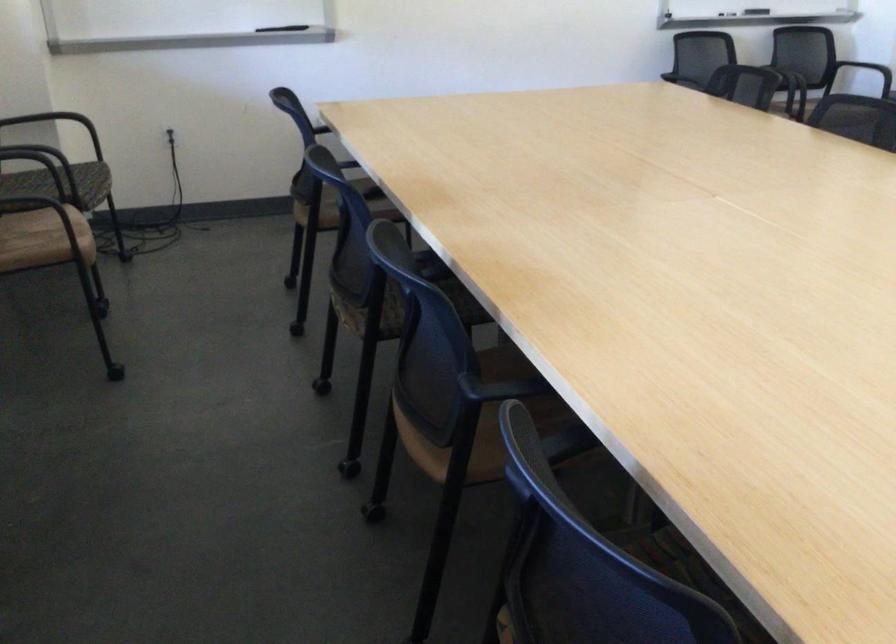
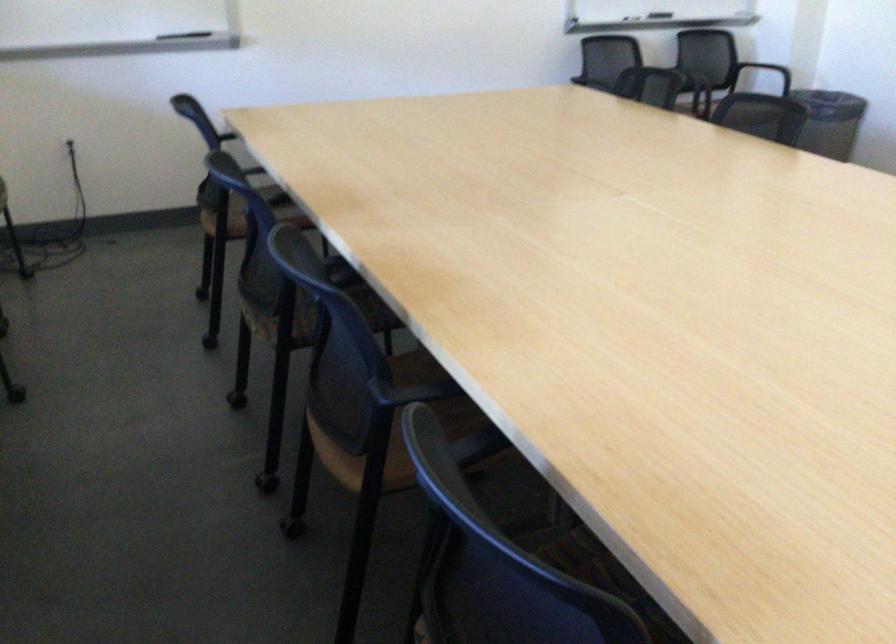
Locate, in the second image, the point that corresponds to (x=371, y=315) in the first image.

(280, 323)